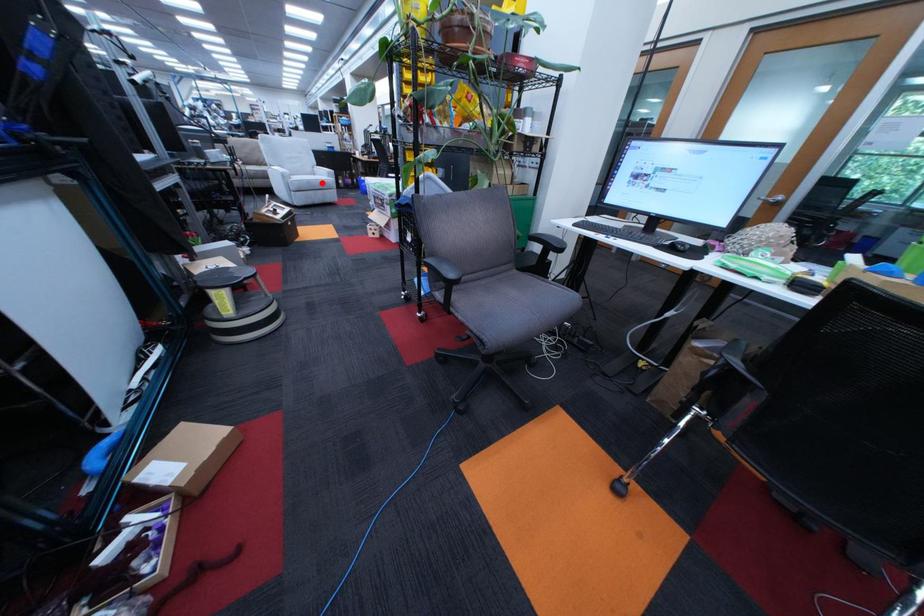
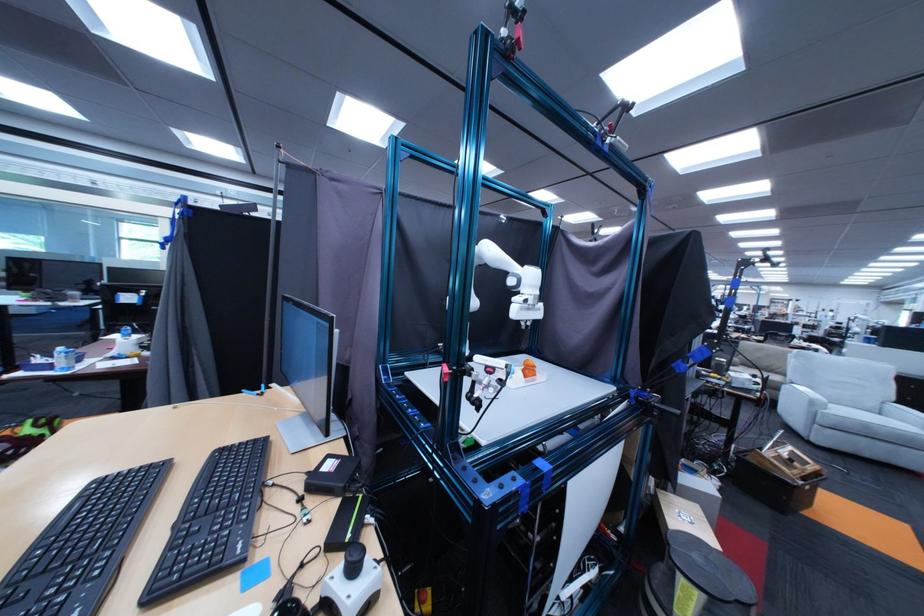
Question: I am providing you with two images of the same scene from different viewpoints. Image1 has a red point marked. In image2, the corresponding 3D location appears at what relative position? Reply with the corresponding letter.

Choices:
 (A) Closer
 (B) Farther

Answer: (B)